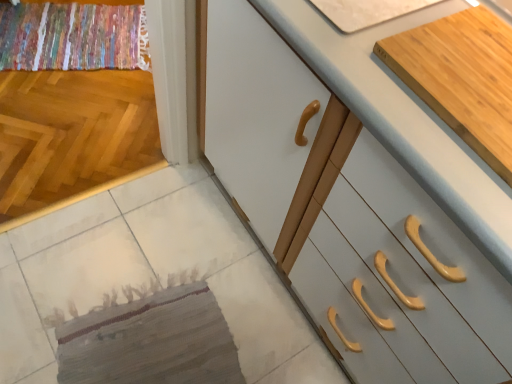
Question: Does white glossy cabinet at center, the 1th cabinetry positioned from the front, have a smaller size compared to textured beige mat at lower left?

Choices:
 (A) yes
 (B) no

Answer: (B)

Question: Considering the relative sizes of white glossy cabinet at center, the 1th cabinetry positioned from the front, and textured beige mat at lower left in the image provided, is white glossy cabinet at center, the 1th cabinetry positioned from the front, taller than textured beige mat at lower left?

Choices:
 (A) yes
 (B) no

Answer: (A)

Question: Is white glossy cabinet at center, the 1th cabinetry positioned from the front, oriented towards textured beige mat at lower left?

Choices:
 (A) yes
 (B) no

Answer: (A)

Question: Is white glossy cabinet at center, the 1th cabinetry positioned from the front, positioned beyond the bounds of textured beige mat at lower left?

Choices:
 (A) yes
 (B) no

Answer: (A)

Question: From the image's perspective, does white glossy cabinet at center, which is the 2th cabinetry in back-to-front order, appear higher than textured beige mat at lower left?

Choices:
 (A) yes
 (B) no

Answer: (A)

Question: Considering the positions of point (378, 304) and point (6, 46), is point (378, 304) closer or farther from the camera than point (6, 46)?

Choices:
 (A) closer
 (B) farther

Answer: (A)

Question: Considering the positions of white glossy cabinet at center, which is the 2th cabinetry in back-to-front order, and multicolored woven rug at upper left in the image, is white glossy cabinet at center, which is the 2th cabinetry in back-to-front order, bigger or smaller than multicolored woven rug at upper left?

Choices:
 (A) big
 (B) small

Answer: (A)

Question: From the image's perspective, is white glossy cabinet at center, which is the 2th cabinetry in back-to-front order, above or below multicolored woven rug at upper left?

Choices:
 (A) below
 (B) above

Answer: (A)

Question: From a real-world perspective, relative to multicolored woven rug at upper left, is white glossy cabinet at center, the 1th cabinetry positioned from the front, vertically above or below?

Choices:
 (A) below
 (B) above

Answer: (B)

Question: Choose the correct answer: Is textured beige mat at lower left inside light wood cutting board at upper right, which ranks as the first cabinetry in back-to-front order, or outside it?

Choices:
 (A) inside
 (B) outside

Answer: (B)

Question: Does point [x=163, y=370] appear closer or farther from the camera than point [x=498, y=172]?

Choices:
 (A) closer
 (B) farther

Answer: (B)

Question: In the image, is textured beige mat at lower left on the left side or the right side of light wood cutting board at upper right, which ranks as the first cabinetry in back-to-front order?

Choices:
 (A) right
 (B) left

Answer: (B)

Question: Based on their sizes in the image, would you say textured beige mat at lower left is bigger or smaller than light wood cutting board at upper right, which ranks as the first cabinetry in back-to-front order?

Choices:
 (A) small
 (B) big

Answer: (A)

Question: From a real-world perspective, is white glossy cabinet at center, which is the 2th cabinetry in back-to-front order, physically located above or below light wood cutting board at upper right, which is the second cabinetry from front to back?

Choices:
 (A) above
 (B) below

Answer: (B)

Question: Is white glossy cabinet at center, which is the 2th cabinetry in back-to-front order, bigger or smaller than light wood cutting board at upper right, which ranks as the first cabinetry in back-to-front order?

Choices:
 (A) small
 (B) big

Answer: (B)